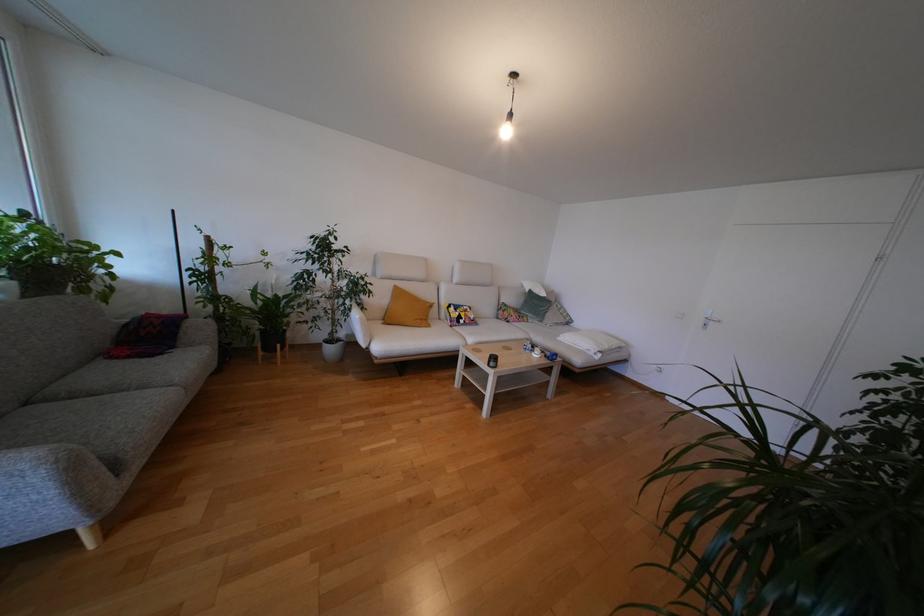
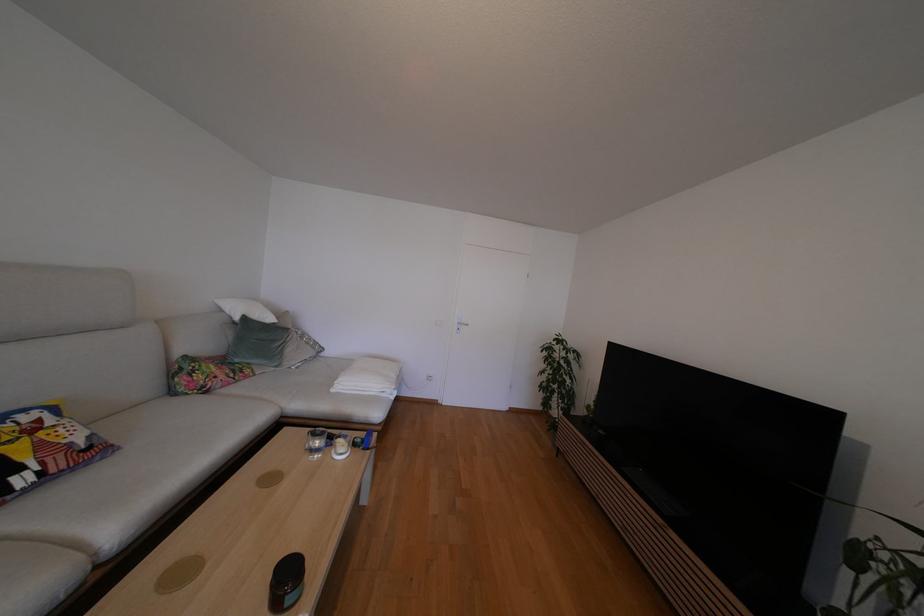
Where in the second image is the point corresponding to pixel 513 310 from the first image?

(207, 368)